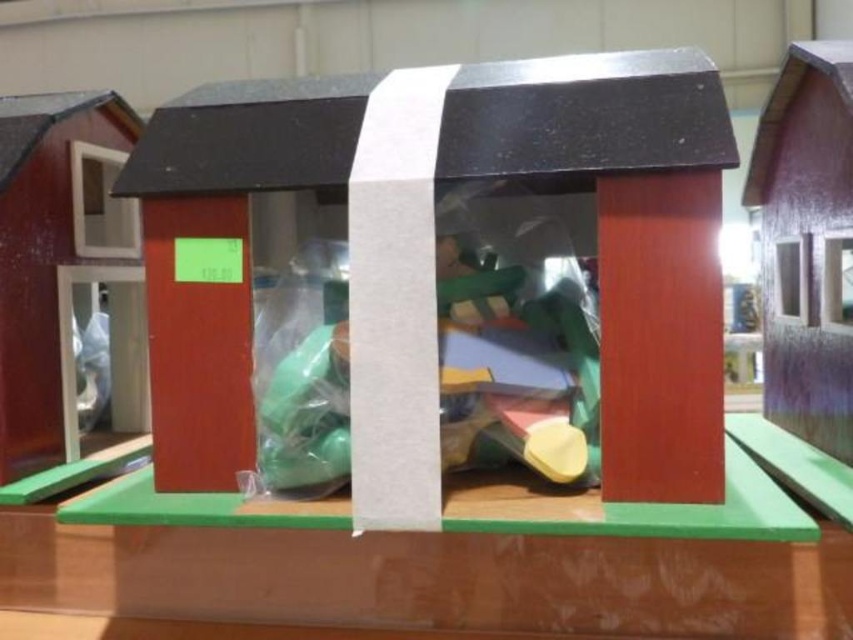
Is matte plastic toys at center wider than wooden barn door at left?

Correct, the width of matte plastic toys at center exceeds that of wooden barn door at left.

Between matte plastic toys at center and wooden barn door at left, which one has more height?

Standing taller between the two is wooden barn door at left.

I want to click on matte plastic toys at center, so click(x=517, y=358).

Is matte plastic toys at center to the right of purple wood house at right from the viewer's perspective?

In fact, matte plastic toys at center is to the left of purple wood house at right.

Is matte plastic toys at center wider than purple wood house at right?

Yes.

Is point (457, 339) behind point (849, 353)?

No.

You are a GUI agent. You are given a task and a screenshot of the screen. Output one action in this format:
    pyautogui.click(x=<x>, y=<y>)
    Task: Click on the matte plastic toys at center
    This screenshot has height=640, width=853.
    Given the screenshot: What is the action you would take?
    pos(517,358)

This screenshot has width=853, height=640. Describe the element at coordinates (68, 294) in the screenshot. I see `wooden barn door at left` at that location.

Is point (6, 259) farther from viewer compared to point (815, 198)?

No.

The height and width of the screenshot is (640, 853). Identify the location of wooden barn door at left. (68, 294).